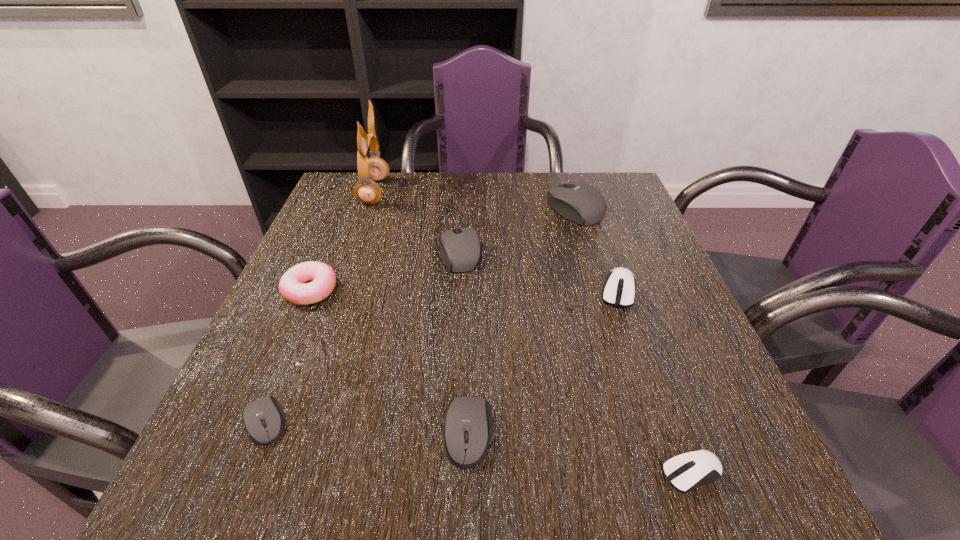
Where is `free area in between the farthest black computer equipment and the bigger white mouse`? This screenshot has width=960, height=540. free area in between the farthest black computer equipment and the bigger white mouse is located at coordinates (596, 250).

In order to click on blank region between the third nearest black computer equipment and the smaller white mouse in this screenshot , I will do `click(576, 363)`.

The image size is (960, 540). Find the location of `free space between the pink doughnut and the smaller white mouse`. free space between the pink doughnut and the smaller white mouse is located at coordinates (501, 381).

Where is `empty space between the bigger white mouse and the rightmost black computer equipment`? The image size is (960, 540). empty space between the bigger white mouse and the rightmost black computer equipment is located at coordinates (596, 250).

Locate an element on the screen. This screenshot has height=540, width=960. object that can be found as the sixth closest to the pink doughnut is located at coordinates [619, 290].

The image size is (960, 540). In order to click on object that stands as the third closest to the third biggest black computer equipment in this screenshot , I will do `click(619, 290)`.

Image resolution: width=960 pixels, height=540 pixels. What are the coordinates of `computer equipment that stands as the closest to the smaller white mouse` in the screenshot? It's located at (468, 425).

Identify which computer equipment is located as the fourth nearest to the second smallest black computer equipment. Please provide its 2D coordinates. Your answer should be formatted as a tuple, i.e. [(x, y)], where the tuple contains the x and y coordinates of a point satisfying the conditions above.

[(460, 249)]

Where is `black computer equipment object that ranks as the closest to the farthest computer equipment`? The width and height of the screenshot is (960, 540). black computer equipment object that ranks as the closest to the farthest computer equipment is located at coordinates (460, 249).

Locate an element on the screen. The image size is (960, 540). black computer equipment that is the second nearest to the smaller white mouse is located at coordinates (460, 249).